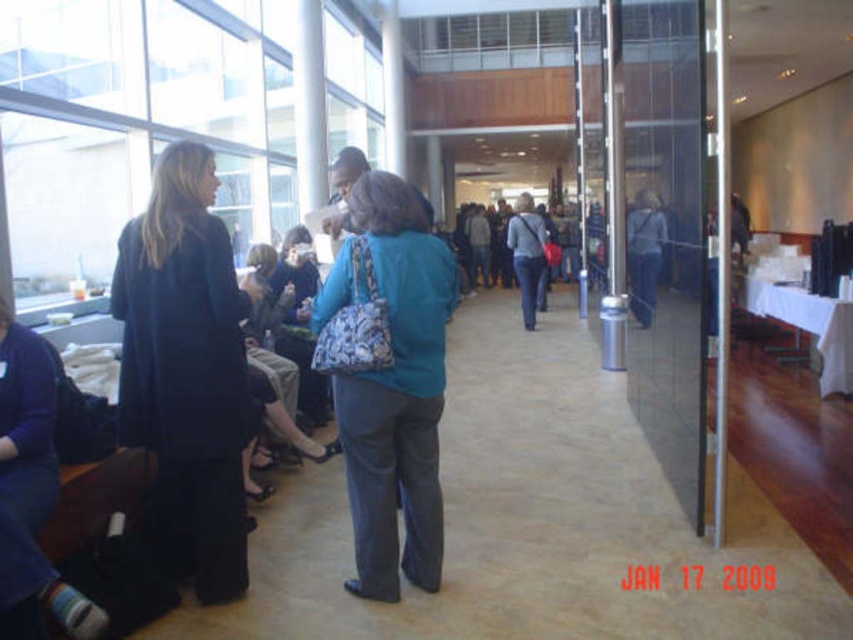
You are standing at the center of the conference hall. There is a point marked at coordinates (x=186, y=371). What object is located at that point?

The dark blue fabric coat at left is located at point (x=186, y=371).

You are standing in the conference hall and need to hand a document to the person closest to you. Which object from the dark blue fabric coat at left and the teal fabric purse at center is nearer to you?

The dark blue fabric coat at left is closer to the viewer than the teal fabric purse at center, so you should hand the document to the person wearing the dark blue fabric coat at left.

You are organizing a photo shoot and need to place two models wearing the dark blue fabric coat at left and the blue fabric jacket at center. Given their clothing dimensions, which model should stand closer to the camera to ensure both appear equally wide in the photo?

The dark blue fabric coat at left is wider than the blue fabric jacket at center. To make them appear equally wide in the photo, the model wearing the narrower blue fabric jacket at center should stand closer to the camera.